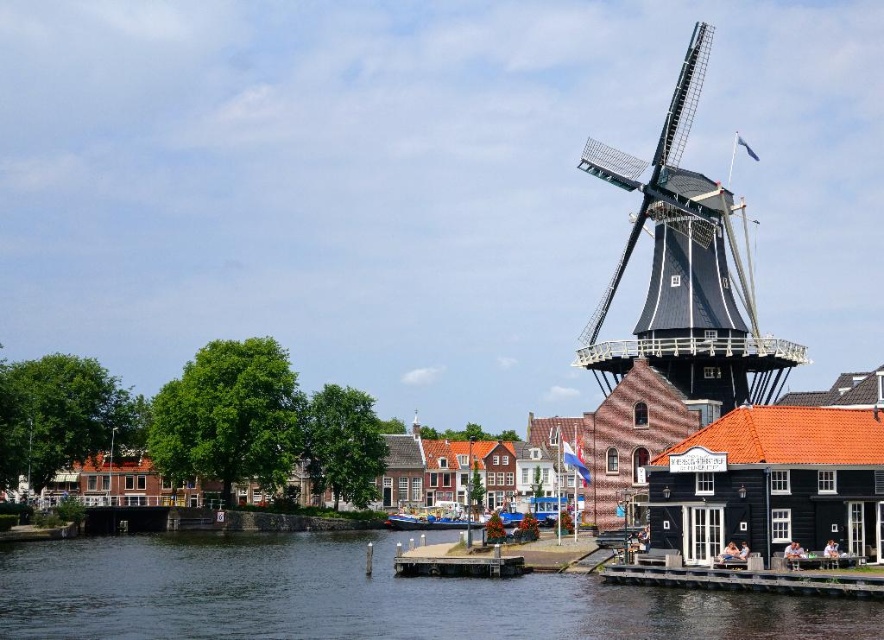
You are standing on the wooden pier and want to take a photo of the dark brown wooden windmill at right and the blue wooden boat at center. Which object should you frame first in your camera viewfinder to ensure both are in the shot?

A: You should frame the dark brown wooden windmill at right first because it is positioned to the right of the blue wooden boat at center, so starting with the windmill ensures there is enough space to include the boat as well.

You are a tourist standing on the pier and want to take a photo of the dark blue water at lower left and the blue wooden boat at center. Which object should you point your camera towards first if you want to capture both in one shot?

You should point your camera towards the dark blue water at lower left first since it is to the left of the blue wooden boat at center, allowing both to be captured in the frame.

You are a tourist standing on the pier and want to take a photo of the dark brown wooden windmill at right and the blue wooden boat at center. Which object should you focus on first if you want to include both in your photo without moving your camera?

The dark brown wooden windmill at right is located above the blue wooden boat at center, so you should focus on the dark brown wooden windmill at right first to ensure both are in frame.